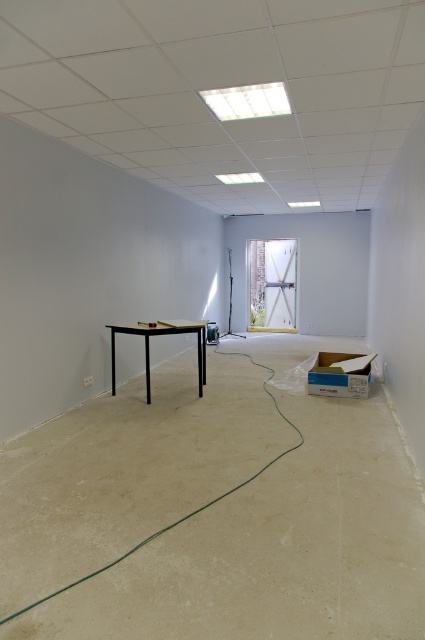
Question: Among these objects, which one is farthest from the camera?

Choices:
 (A) black matte table at center
 (B) transparent glass window at upper center

Answer: (A)

Question: Does clear glass window at center have a greater width compared to transparent glass window at upper center?

Choices:
 (A) yes
 (B) no

Answer: (A)

Question: Which of the following is the closest to the observer?

Choices:
 (A) [289, 109]
 (B) [149, 332]

Answer: (A)

Question: Which point is farther from the camera taking this photo?

Choices:
 (A) (192, 330)
 (B) (224, 113)

Answer: (A)

Question: Does clear glass window at center appear over transparent glass window at upper center?

Choices:
 (A) no
 (B) yes

Answer: (A)

Question: Is transparent glass window at upper center behind black matte table at center?

Choices:
 (A) yes
 (B) no

Answer: (B)